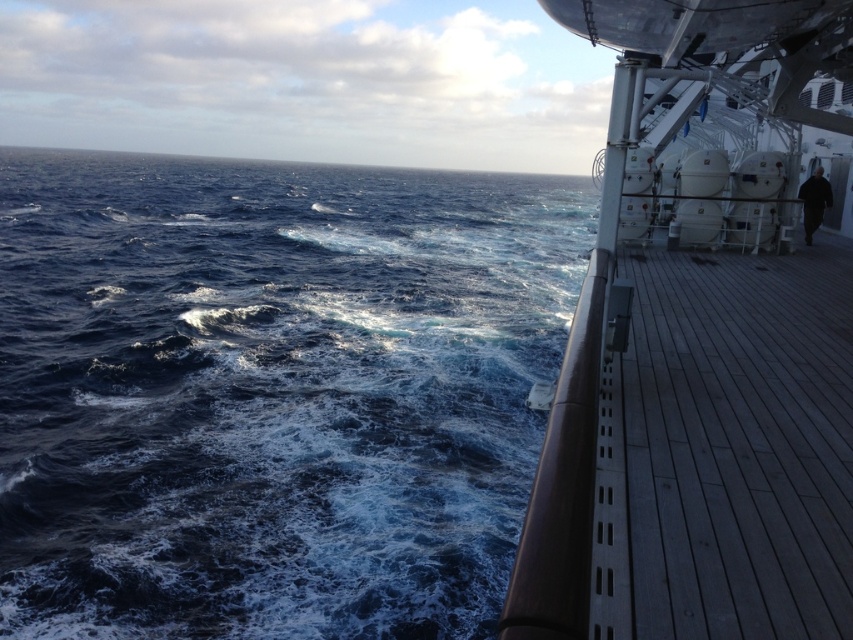
Which is more to the left, dark blue water at left or wooden deck at right?

dark blue water at left is more to the left.

Who is more forward, [428,433] or [749,400]?

Point [749,400] is more forward.

At what (x,y) coordinates should I click in order to perform the action: click on dark blue water at left. Please return your answer as a coordinate pair (x, y). The height and width of the screenshot is (640, 853). Looking at the image, I should click on tap(271, 392).

Who is more distant from viewer, (91, 461) or (759, 605)?

The point (91, 461) is behind.

Which is below, dark blue water at left or wooden at right?

wooden at right is lower down.

Where is `dark blue water at left`? The image size is (853, 640). dark blue water at left is located at coordinates (271, 392).

Can you confirm if wooden deck at right is positioned to the right of wooden at right?

Yes, wooden deck at right is to the right of wooden at right.

Where is `wooden deck at right`? The width and height of the screenshot is (853, 640). wooden deck at right is located at coordinates (699, 346).